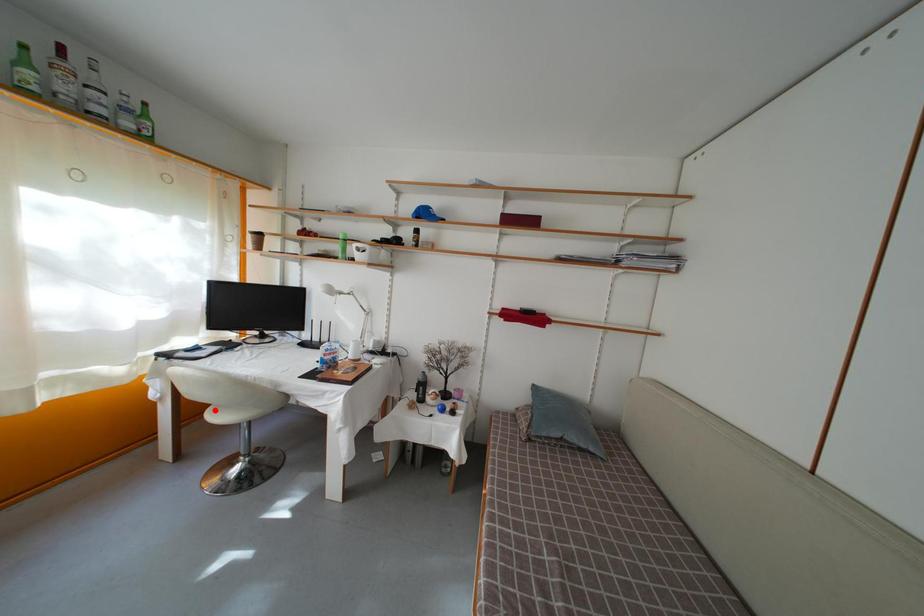
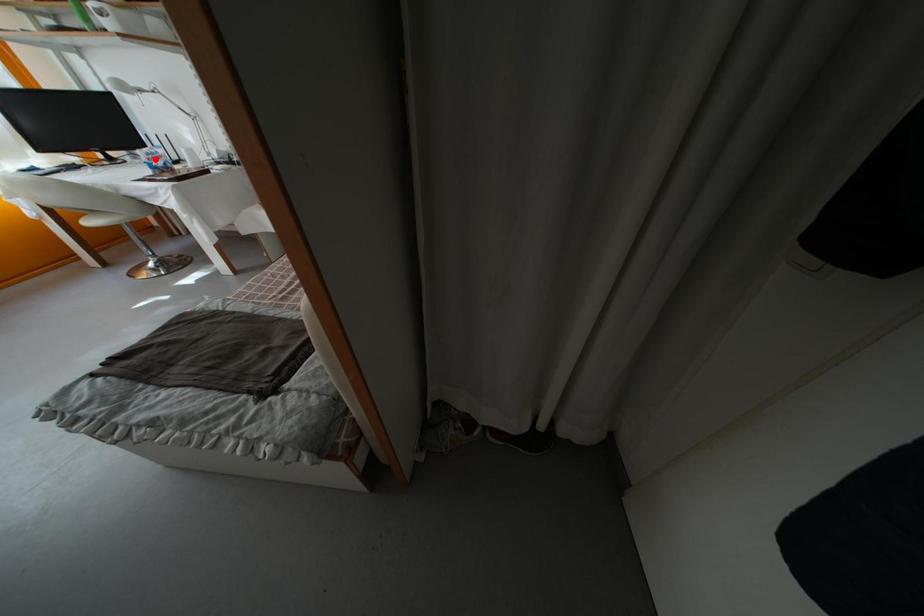
In the scene shown: I am providing you with two images of the same scene from different viewpoints. A red point is marked on the first image and another point is marked on the second image. Is the marked point in image1 the same physical position as the marked point in image2?

No